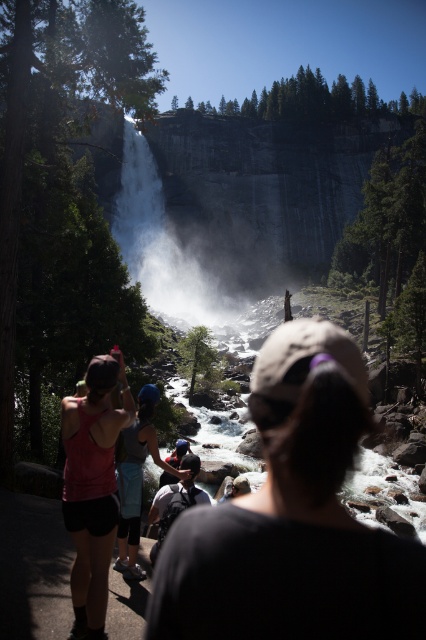
Is black fabric backpack at center taller than white cotton shirt at center?

Yes.

Which is more to the left, black fabric backpack at center or white cotton shirt at center?

Positioned to the left is white cotton shirt at center.

The image size is (426, 640). What are the coordinates of `black fabric backpack at center` in the screenshot? It's located at (293, 518).

Where is `black fabric backpack at center`? black fabric backpack at center is located at coordinates (293, 518).

Does black fabric backpack at center appear on the left side of white textured waterfall at center?

Incorrect, black fabric backpack at center is not on the left side of white textured waterfall at center.

The height and width of the screenshot is (640, 426). What are the coordinates of `black fabric backpack at center` in the screenshot? It's located at tap(293, 518).

Which is behind, point (287, 330) or point (206, 285)?

The point (206, 285) is more distant.

The image size is (426, 640). Identify the location of black fabric backpack at center. (293, 518).

Can you confirm if white textured waterfall at center is positioned above white cotton shirt at center?

Yes, white textured waterfall at center is above white cotton shirt at center.

The height and width of the screenshot is (640, 426). What do you see at coordinates (163, 248) in the screenshot? I see `white textured waterfall at center` at bounding box center [163, 248].

This screenshot has width=426, height=640. What do you see at coordinates (163, 248) in the screenshot?
I see `white textured waterfall at center` at bounding box center [163, 248].

Identify the location of white textured waterfall at center. (163, 248).